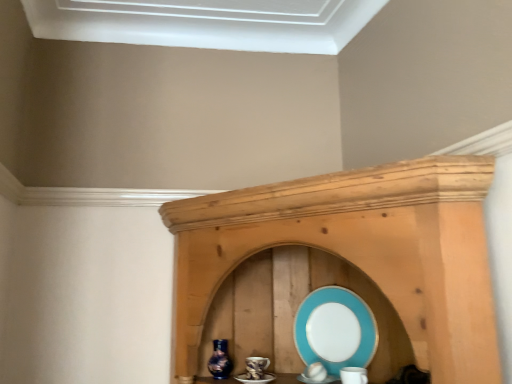
What are the coordinates of `shiny blue glass vase at center` in the screenshot? It's located at (220, 360).

Measure the distance between point (213, 356) and camera.

4.22 feet.

Image resolution: width=512 pixels, height=384 pixels. What do you see at coordinates (220, 360) in the screenshot? I see `shiny blue glass vase at center` at bounding box center [220, 360].

This screenshot has width=512, height=384. Find the location of `turquoise glossy platter at center`. turquoise glossy platter at center is located at coordinates (335, 330).

This screenshot has height=384, width=512. Describe the element at coordinates (335, 330) in the screenshot. I see `turquoise glossy platter at center` at that location.

The image size is (512, 384). In order to click on shiny blue glass vase at center in this screenshot , I will do `click(220, 360)`.

Considering the positions of objects turquoise glossy platter at center and shiny blue glass vase at center in the image provided, who is more to the right, turquoise glossy platter at center or shiny blue glass vase at center?

turquoise glossy platter at center.

Does turquoise glossy platter at center lie in front of shiny blue glass vase at center?

Yes, the depth of turquoise glossy platter at center is less than that of shiny blue glass vase at center.

Is point (341, 297) closer to camera compared to point (217, 351)?

That is True.

From the image's perspective, between turquoise glossy platter at center and shiny blue glass vase at center, which one is located above?

turquoise glossy platter at center is shown above in the image.

From a real-world perspective, is turquoise glossy platter at center under shiny blue glass vase at center?

No, from a real-world perspective, turquoise glossy platter at center is not beneath shiny blue glass vase at center.

Considering the relative sizes of turquoise glossy platter at center and shiny blue glass vase at center in the image provided, is turquoise glossy platter at center wider than shiny blue glass vase at center?

No.

Considering the sizes of objects turquoise glossy platter at center and shiny blue glass vase at center in the image provided, who is taller, turquoise glossy platter at center or shiny blue glass vase at center?

turquoise glossy platter at center is taller.

Is turquoise glossy platter at center bigger than shiny blue glass vase at center?

Yes, turquoise glossy platter at center is bigger than shiny blue glass vase at center.

Would you say shiny blue glass vase at center is part of turquoise glossy platter at center's contents?

Definitely not — shiny blue glass vase at center is not inside turquoise glossy platter at center.

From the picture: Is turquoise glossy platter at center far away from shiny blue glass vase at center?

turquoise glossy platter at center is actually quite close to shiny blue glass vase at center.

Could you tell me if turquoise glossy platter at center is turned towards shiny blue glass vase at center?

No, turquoise glossy platter at center is not aimed at shiny blue glass vase at center.

What's the angular difference between turquoise glossy platter at center and shiny blue glass vase at center's facing directions?

The angular difference between turquoise glossy platter at center and shiny blue glass vase at center is 2.6 degrees.

Image resolution: width=512 pixels, height=384 pixels. Identify the location of vase behind the turquoise glossy platter at center. (220, 360).

Which object is positioned more to the right, shiny blue glass vase at center or turquoise glossy platter at center?

Positioned to the right is turquoise glossy platter at center.

Which object is closer to the camera taking this photo, shiny blue glass vase at center or turquoise glossy platter at center?

turquoise glossy platter at center is closer to the camera.

Which is behind, point (209, 369) or point (339, 315)?

The point (339, 315) is behind.

From the image's perspective, is shiny blue glass vase at center located beneath turquoise glossy platter at center?

Indeed, from the image's perspective, shiny blue glass vase at center is shown beneath turquoise glossy platter at center.

From a real-world perspective, is shiny blue glass vase at center on top of turquoise glossy platter at center?

No, from a real-world perspective, shiny blue glass vase at center is not over turquoise glossy platter at center

Consider the image. Which object is wider, shiny blue glass vase at center or turquoise glossy platter at center?

With larger width is shiny blue glass vase at center.

Consider the image. Considering the relative sizes of shiny blue glass vase at center and turquoise glossy platter at center in the image provided, is shiny blue glass vase at center shorter than turquoise glossy platter at center?

Indeed, shiny blue glass vase at center has a lesser height compared to turquoise glossy platter at center.

Which of these two, shiny blue glass vase at center or turquoise glossy platter at center, is bigger?

Bigger between the two is turquoise glossy platter at center.

Do you think shiny blue glass vase at center is within turquoise glossy platter at center, or outside of it?

shiny blue glass vase at center is not enclosed by turquoise glossy platter at center.

Is shiny blue glass vase at center next to turquoise glossy platter at center and touching it?

shiny blue glass vase at center and turquoise glossy platter at center are not in contact.

Is shiny blue glass vase at center turned away from turquoise glossy platter at center?

No, shiny blue glass vase at center is not facing the opposite direction of turquoise glossy platter at center.

I want to click on vase behind the turquoise glossy platter at center, so click(x=220, y=360).

Image resolution: width=512 pixels, height=384 pixels. I want to click on platter in front of the shiny blue glass vase at center, so click(x=335, y=330).

Identify the location of platter above the shiny blue glass vase at center (from a real-world perspective). This screenshot has height=384, width=512. tap(335, 330).